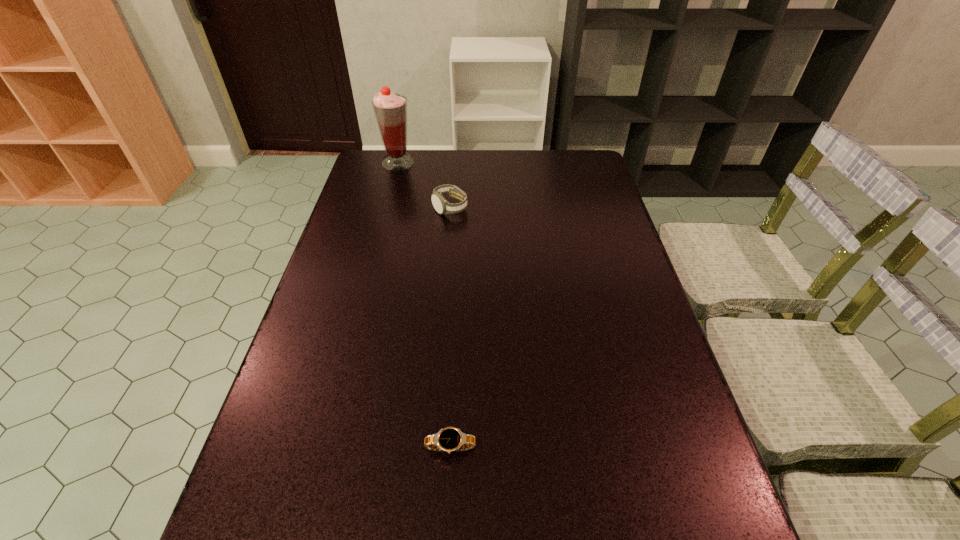
Identify the location of vacant space in between the taller watch and the farthest object. This screenshot has height=540, width=960. (424, 185).

Image resolution: width=960 pixels, height=540 pixels. I want to click on free point between the shorter watch and the taller watch, so click(x=450, y=328).

I want to click on free space between the nearest object and the farther watch, so click(450, 328).

Locate an element on the screen. The image size is (960, 540). vacant area that lies between the leftmost object and the farther watch is located at coordinates (424, 185).

Select which object appears as the second closest to the smoothie. Please provide its 2D coordinates. Your answer should be formatted as a tuple, i.e. [(x, y)], where the tuple contains the x and y coordinates of a point satisfying the conditions above.

[(450, 439)]

Locate an element on the screen. object that ranks as the closest to the smoothie is located at coordinates (441, 205).

The image size is (960, 540). In order to click on vacant region that satisfies the following two spatial constraints: 1. on the face of the shorter watch; 2. on the left side of the taller watch in this screenshot , I will do `click(430, 448)`.